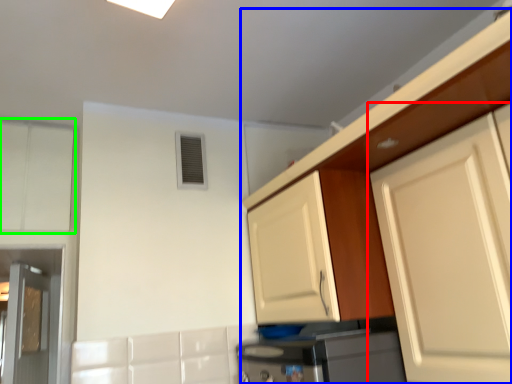
Question: Which object is the farthest from cabinetry (highlighted by a red box)? Choose among these: cabinetry (highlighted by a blue box) or cabinetry (highlighted by a green box).

Choices:
 (A) cabinetry
 (B) cabinetry

Answer: (B)